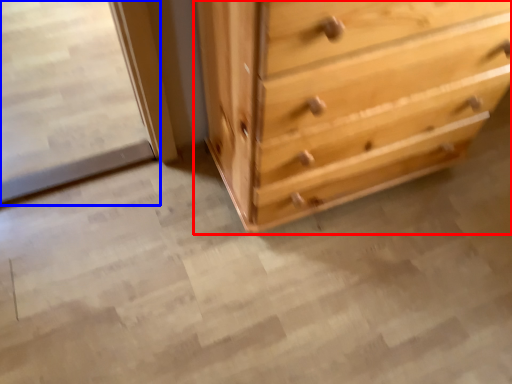
Question: Which point is further to the camera, chest of drawers (highlighted by a red box) or screen door (highlighted by a blue box)?

Choices:
 (A) chest of drawers
 (B) screen door

Answer: (B)